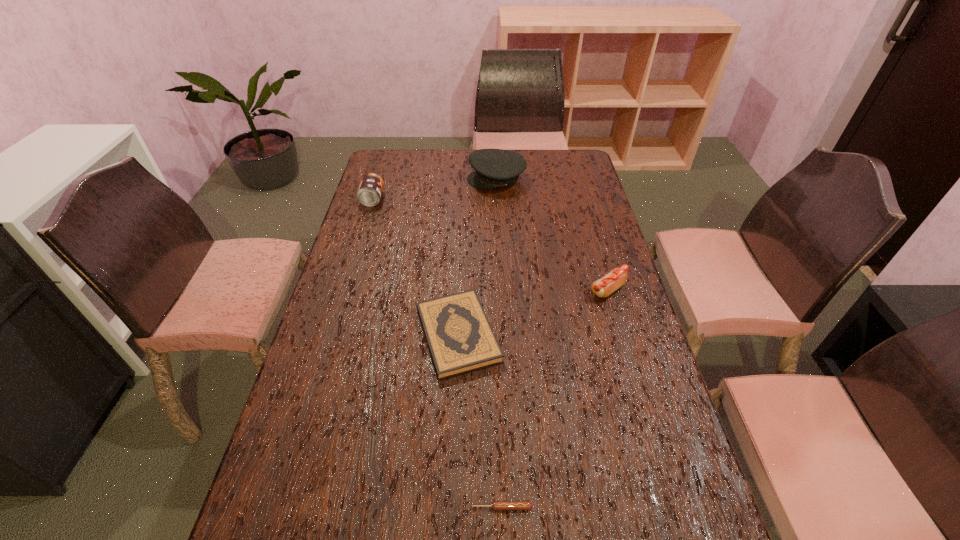
Find the location of a particular element. The image size is (960, 540). beret is located at coordinates point(493,168).

You are a GUI agent. You are given a task and a screenshot of the screen. Output one action in this format:
    pyautogui.click(x=<x>, y=<y>)
    Task: Click on the leftmost object
    The image size is (960, 540).
    Given the screenshot: What is the action you would take?
    pyautogui.click(x=369, y=193)

Locate an element on the screen. The image size is (960, 540). can is located at coordinates (369, 193).

Find the location of a particular element. the rightmost object is located at coordinates (617, 277).

Where is `the taller sausage`? The width and height of the screenshot is (960, 540). the taller sausage is located at coordinates (617, 277).

Identify the location of the second shortest object. The width and height of the screenshot is (960, 540). point(460,338).

You are a GUI agent. You are given a task and a screenshot of the screen. Output one action in this format:
    pyautogui.click(x=<x>, y=<y>)
    Task: Click on the shorter sausage
    
    Given the screenshot: What is the action you would take?
    pos(495,505)

Locate an element on the screen. This screenshot has width=960, height=540. the nearer sausage is located at coordinates (495, 505).

Identify the location of free space located on the front-facing side of the tallest object. This screenshot has width=960, height=540. (369, 179).

The image size is (960, 540). Identify the location of free space located 0.220m on the front-facing side of the tallest object. (413, 179).